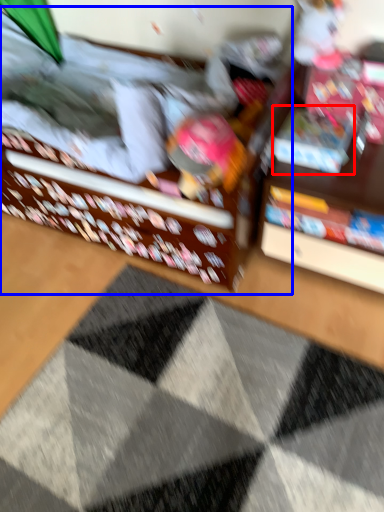
Question: Which object is further to the camera taking this photo, book (highlighted by a red box) or bed (highlighted by a blue box)?

Choices:
 (A) book
 (B) bed

Answer: (A)